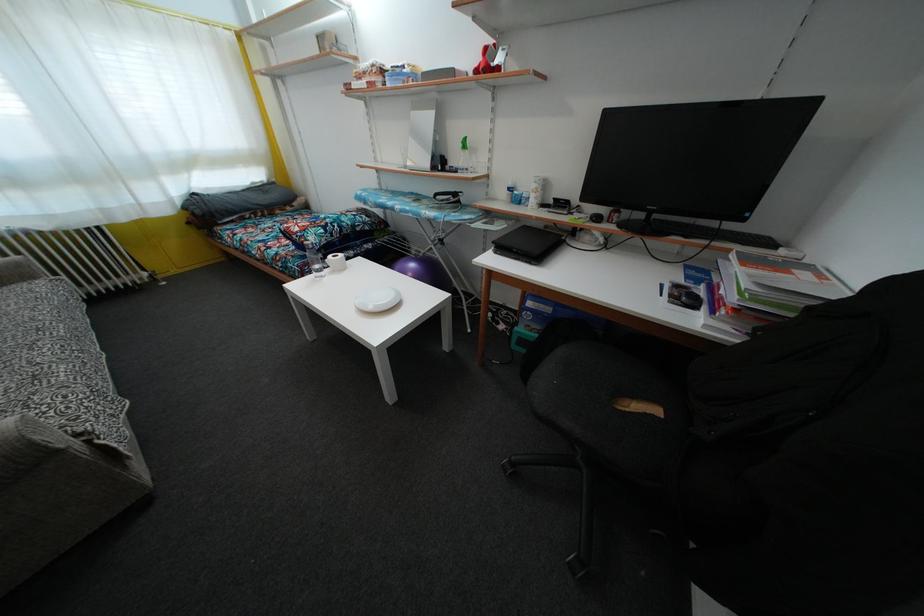
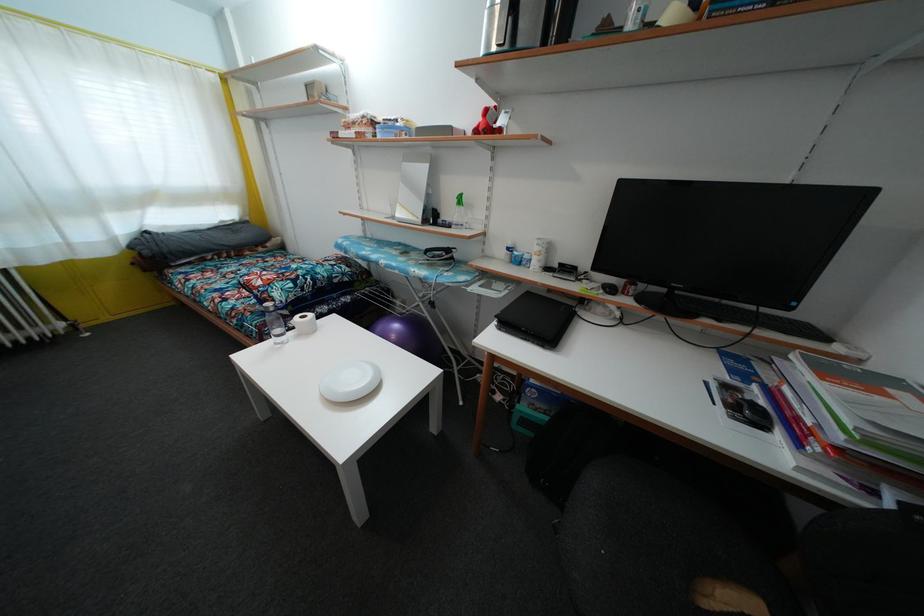
Where in the second image is the point corresponding to (298,244) from the first image?

(259, 299)